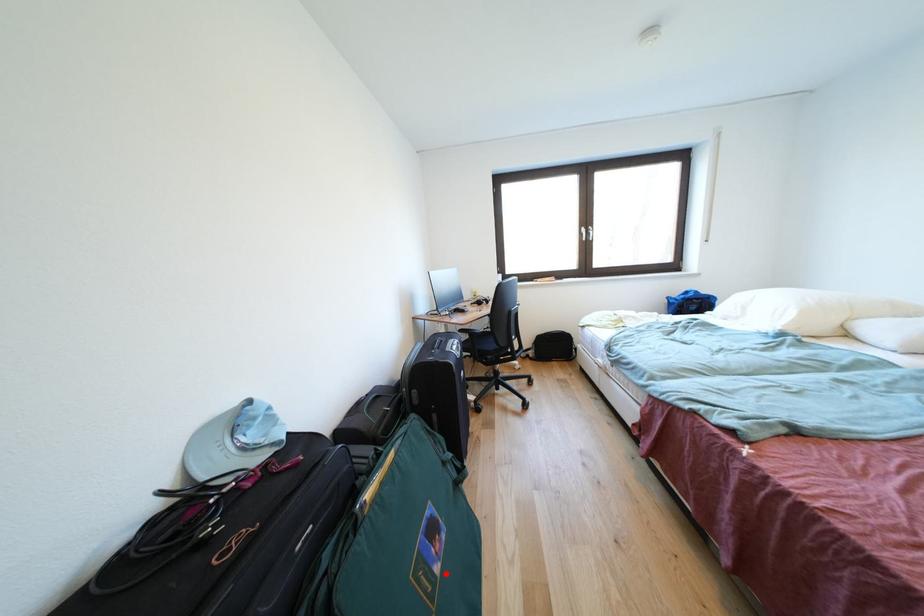
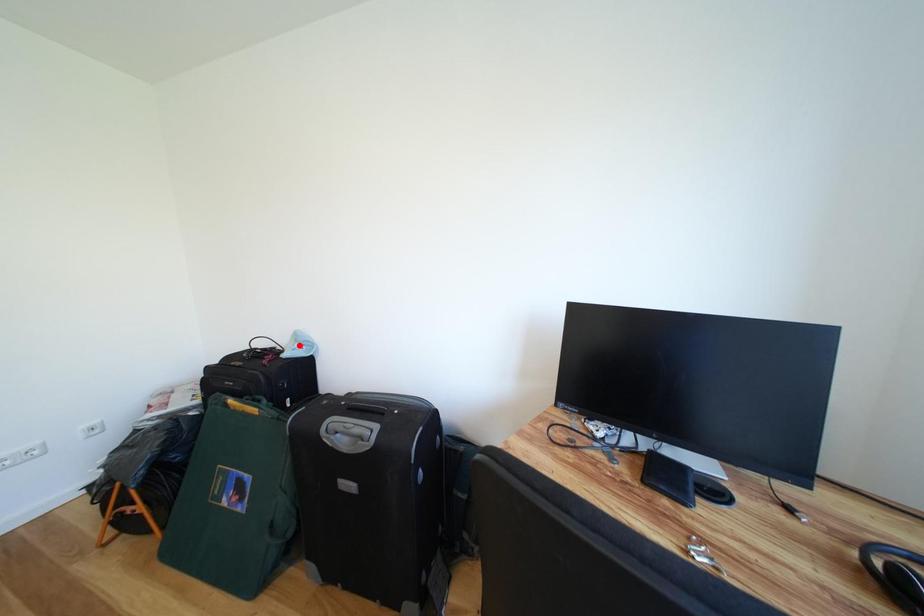
I am providing you with two images of the same scene from different viewpoints. A red point is marked on the first image and another point is marked on the second image. Is the red point in image1 aligned with the point shown in image2?

No